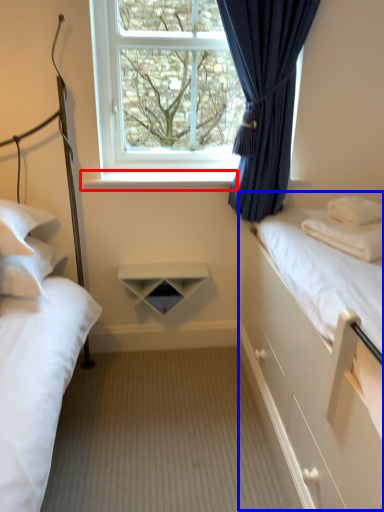
Question: Which object is further to the camera taking this photo, window sill (highlighted by a red box) or bed (highlighted by a blue box)?

Choices:
 (A) window sill
 (B) bed

Answer: (A)